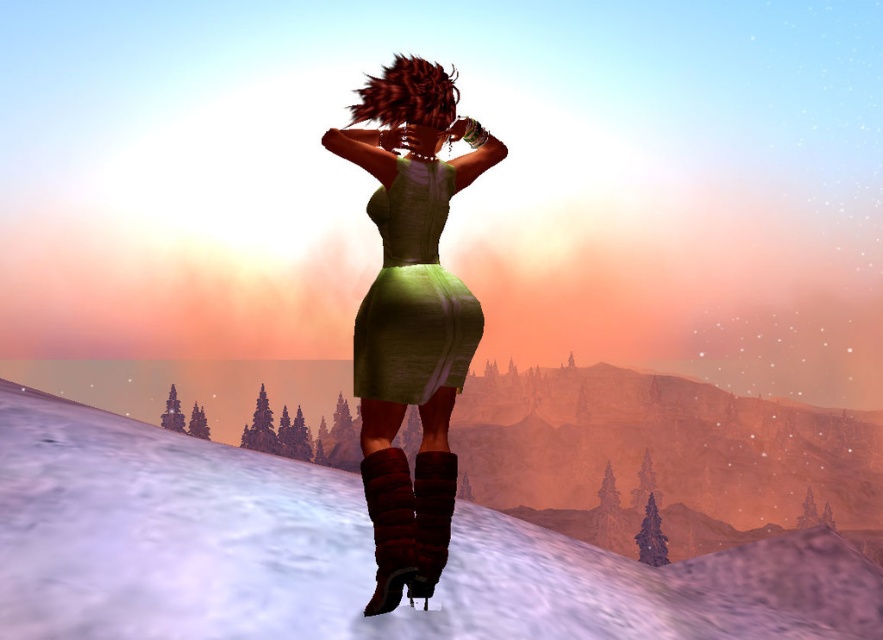
You are a photographer positioned at the green textured dress at center and want to capture the white fluffy snow at lower center in your shot. What is the minimum distance you need to move forward to ensure the snow is in frame?

The minimum distance you need to move forward is 4.46 meters to ensure the white fluffy snow at lower center is in frame, as it is currently 4.46 meters away from the green textured dress at center.

In the scene shown: Based on the scene description, can you determine if the white fluffy snow at lower center is wider than the green textured dress at center?

The white fluffy snow at lower center might be wider than the green textured dress at center according to the description.